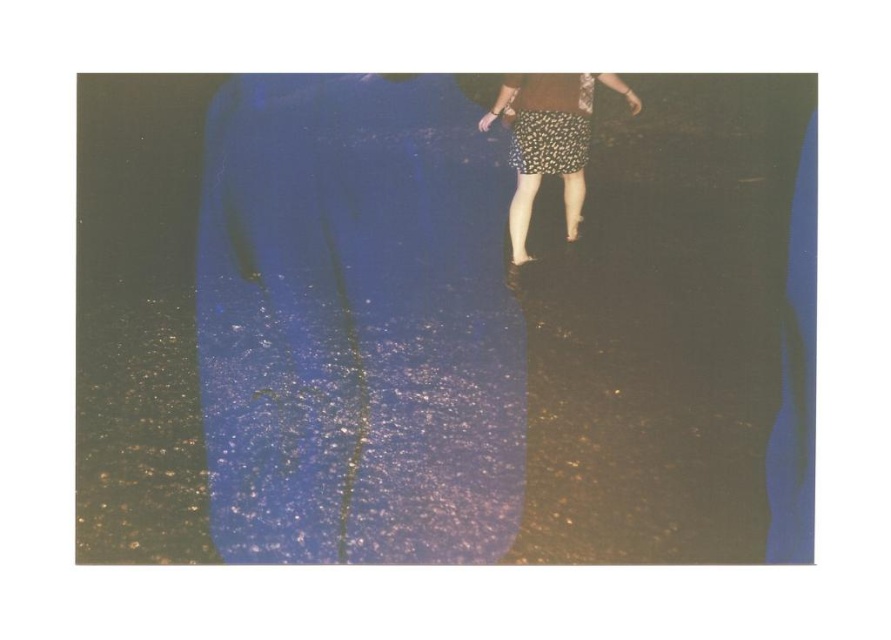
You are a fashion designer looking at a photo of two outfits. The photo shows a floral skirt at center and a floral fabric dress at center. Which outfit appears taller in the image?

The floral skirt at center appears taller than the floral fabric dress at center in the image.

You are standing in the scene and want to move from the point at coordinates point (522, 244) to the point at coordinates point (530, 141). Since both points are on the ground, which direction should you walk to get closer to your destination?

You should walk towards the point at coordinates point (530, 141) because it is closer to you than the point at coordinates point (522, 244), so moving towards it would mean heading in the direction of decreasing coordinates along the horizontal axis.